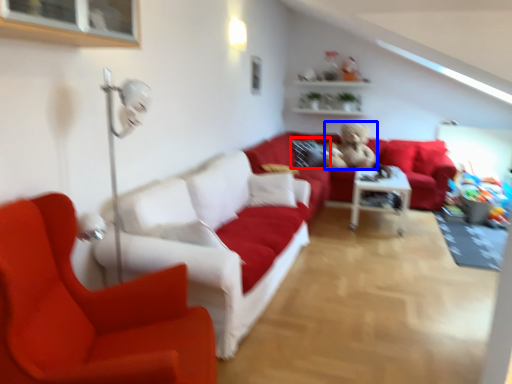
Question: Which of the following is the farthest to the observer, pillow (highlighted by a red box) or figurine (highlighted by a blue box)?

Choices:
 (A) pillow
 (B) figurine

Answer: (A)